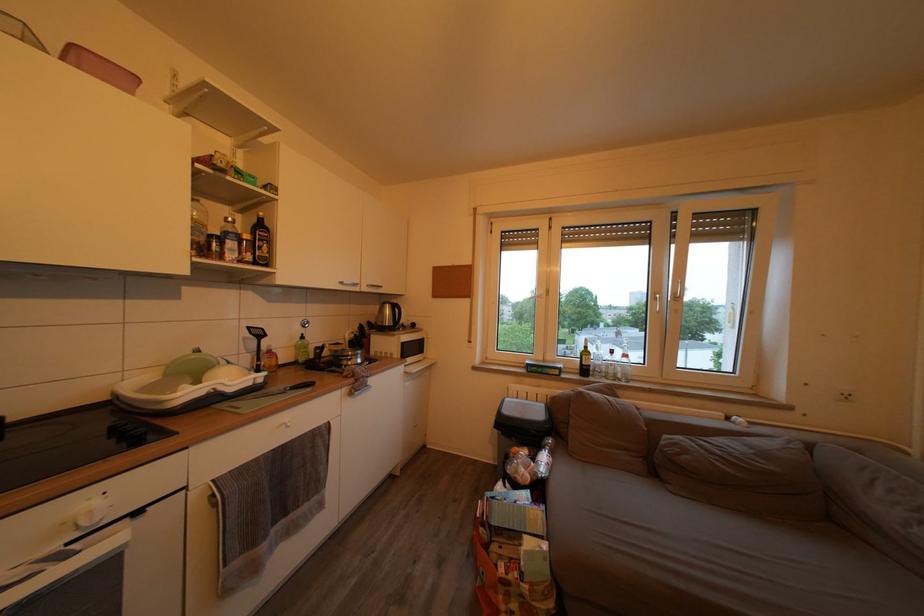
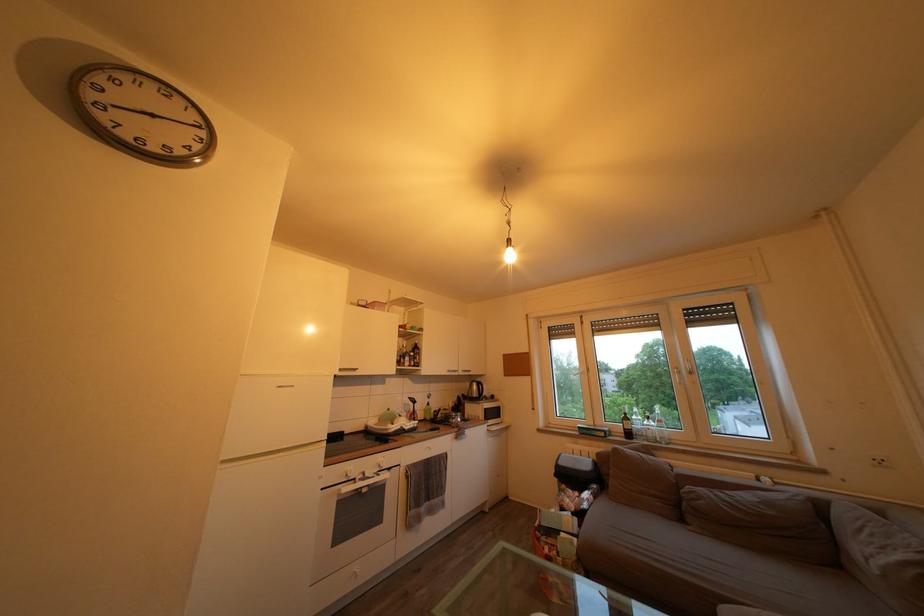
The point at (310, 344) is marked in the first image. Where is the corresponding point in the second image?

(436, 411)